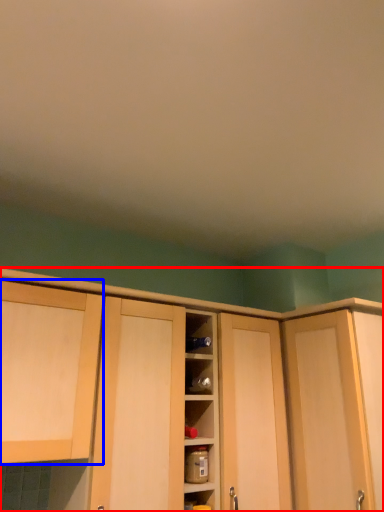
Question: Which object is further to the camera taking this photo, cabinetry (highlighted by a red box) or cabinetry (highlighted by a blue box)?

Choices:
 (A) cabinetry
 (B) cabinetry

Answer: (A)